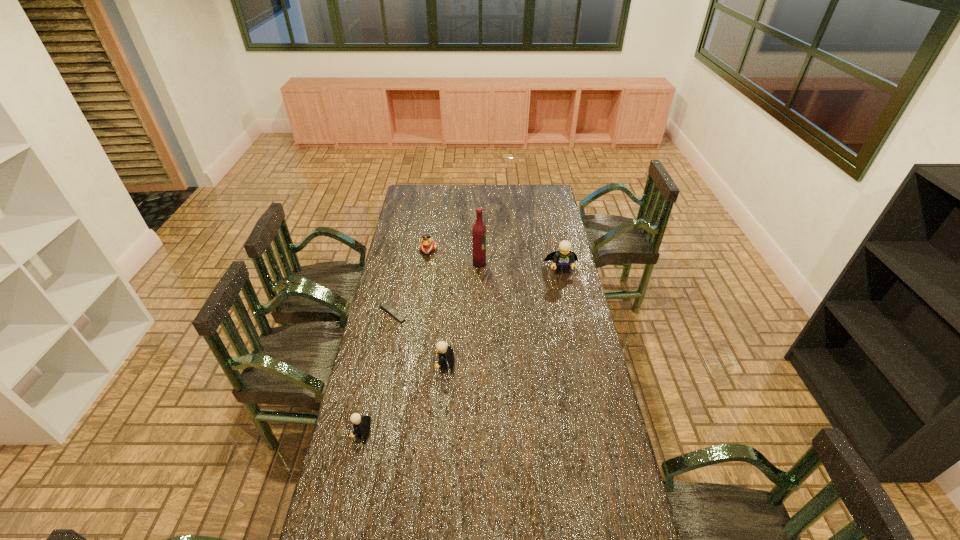
Identify the location of duck located at the left edge. (428, 245).

In order to click on remote control located in the left edge section of the desktop in this screenshot , I will do `click(384, 306)`.

At what (x,y) coordinates should I click in order to perform the action: click on object present at the right edge. Please return your answer as a coordinate pair (x, y). Image resolution: width=960 pixels, height=540 pixels. Looking at the image, I should click on (562, 259).

The image size is (960, 540). In order to click on vacant space at the far edge of the desktop in this screenshot , I will do `click(483, 204)`.

You are a GUI agent. You are given a task and a screenshot of the screen. Output one action in this format:
    pyautogui.click(x=<x>, y=<y>)
    Task: Click on the free space at the left edge
    This screenshot has height=540, width=960.
    Given the screenshot: What is the action you would take?
    pyautogui.click(x=380, y=438)

Locate an element on the screen. vacant space at the right edge is located at coordinates click(x=574, y=356).

Find the location of `free space at the far right corner of the desktop`. free space at the far right corner of the desktop is located at coordinates (543, 190).

You are a GUI agent. You are given a task and a screenshot of the screen. Output one action in this format:
    pyautogui.click(x=<x>, y=<y>)
    Task: Click on the free spot between the fifth shortest object and the fifth object from left to right
    
    Given the screenshot: What is the action you would take?
    pyautogui.click(x=520, y=267)

You are a GUI agent. You are given a task and a screenshot of the screen. Output one action in this format:
    pyautogui.click(x=<x>, y=<y>)
    Task: Click on the vacant region between the tallest Lego and the liquor
    The width and height of the screenshot is (960, 540).
    Given the screenshot: What is the action you would take?
    pyautogui.click(x=520, y=267)

Locate an element on the screen. empty space between the third nearest object and the tallest object is located at coordinates (436, 289).